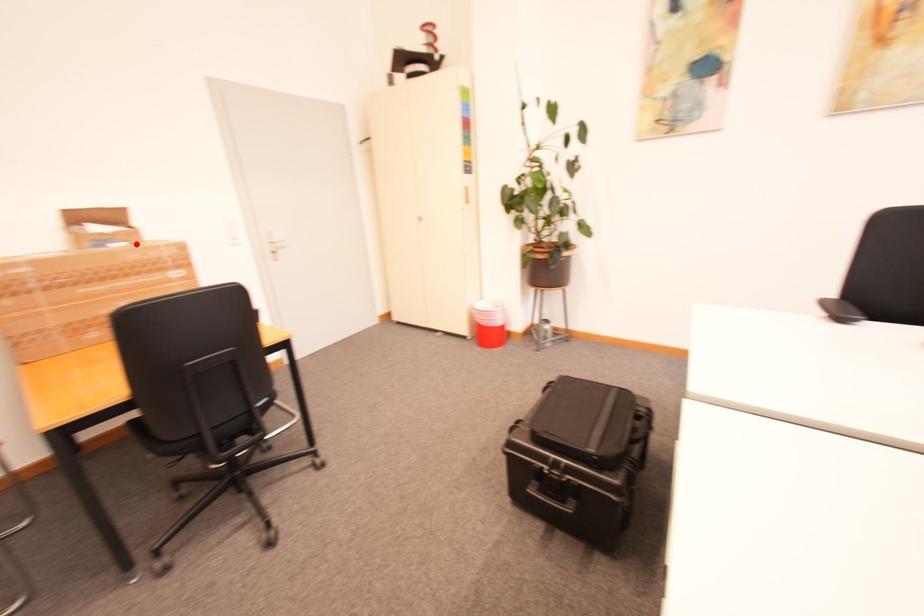
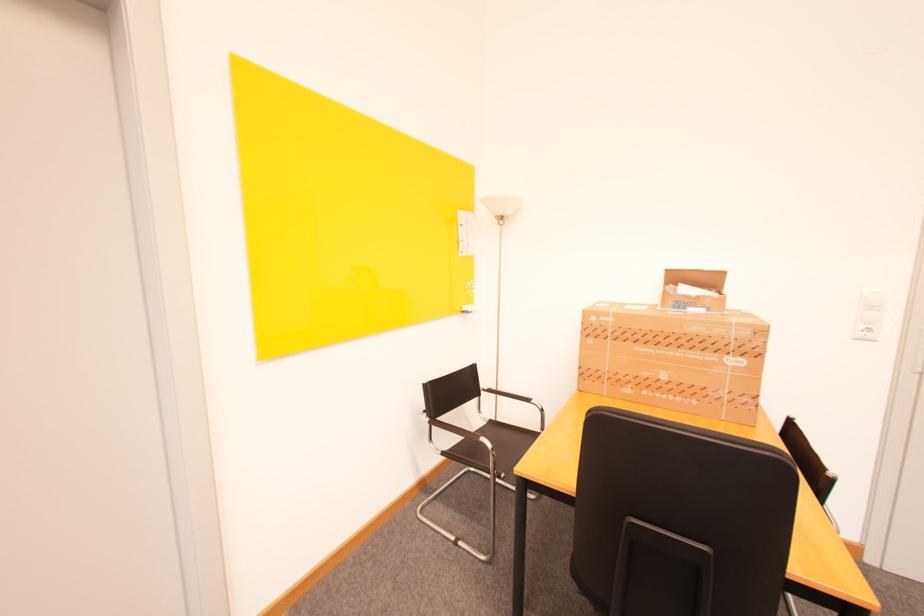
Where in the second image is the point corresponding to the highlighted location from the first image?

(714, 310)